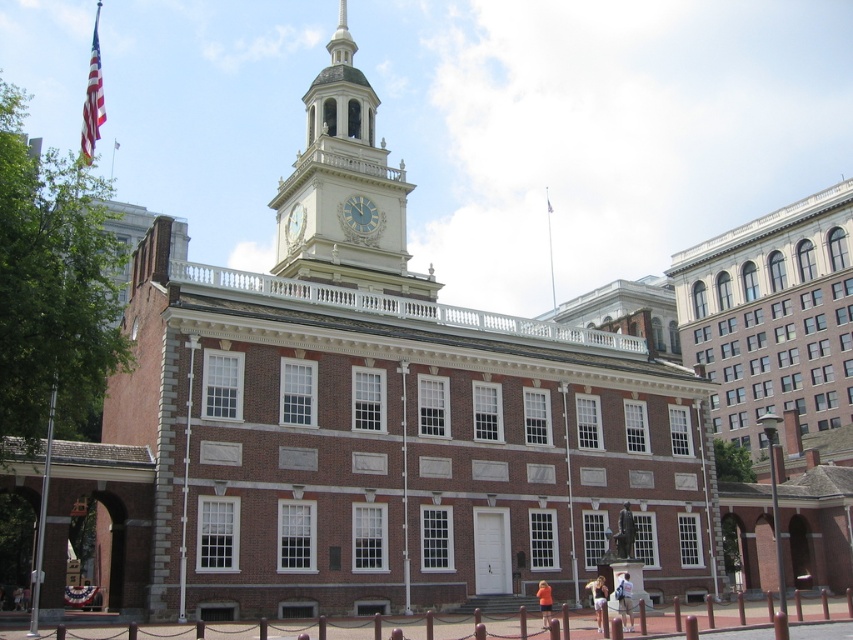
Question: Can you confirm if metallic clock face at center is positioned below gold metallic clock at upper center?

Choices:
 (A) no
 (B) yes

Answer: (A)

Question: In this image, where is american flag at upper left located relative to metallic clock face at center?

Choices:
 (A) above
 (B) below

Answer: (A)

Question: Estimate the real-world distances between objects in this image. Which object is farther from the american flag at upper left?

Choices:
 (A) gold-bronze clock tower at upper center
 (B) bronze statue at center

Answer: (B)

Question: Considering the real-world distances, which object is closest to the light brown leather backpack at lower center?

Choices:
 (A) gold metallic clock at upper center
 (B) denim shorts at lower center

Answer: (B)

Question: Is metallic clock face at center positioned before american flag at upper center?

Choices:
 (A) no
 (B) yes

Answer: (B)

Question: Which object is positioned farthest from the gold metallic clock at upper center?

Choices:
 (A) gold-bronze clock tower at upper center
 (B) american flag at upper center
 (C) american flag at upper left
 (D) light brown leather backpack at lower center

Answer: (B)